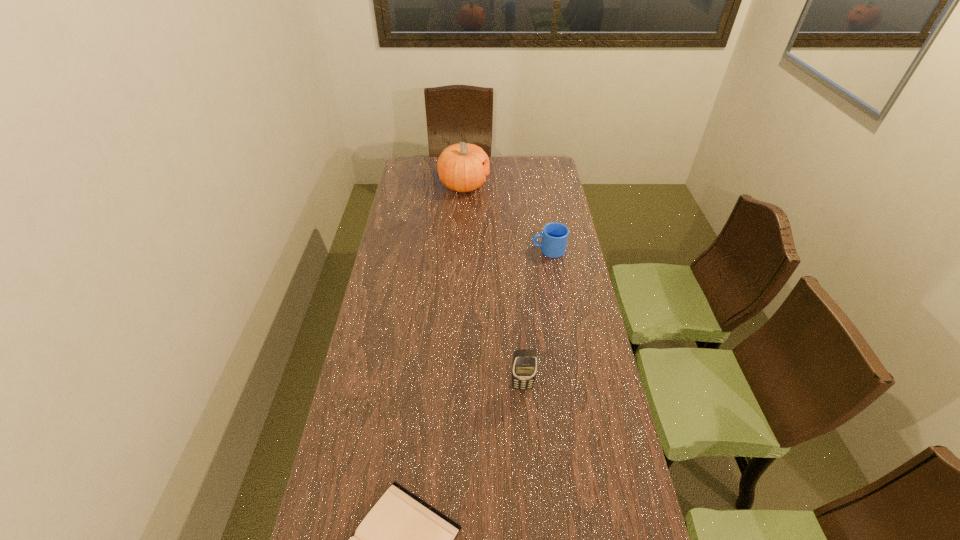
Find the location of a particular element. vacant space situated 0.200m on the side of the mug with the handle is located at coordinates (483, 250).

This screenshot has height=540, width=960. I want to click on object at the far edge, so 463,167.

Image resolution: width=960 pixels, height=540 pixels. Find the location of `object that is at the right edge`. object that is at the right edge is located at coordinates (555, 235).

I want to click on free space at the far edge, so click(523, 179).

The height and width of the screenshot is (540, 960). In the image, there is a desktop. Identify the location of free space at the left edge. (407, 194).

In the image, there is a desktop. Where is `blank space at the right edge`? The width and height of the screenshot is (960, 540). blank space at the right edge is located at coordinates (546, 199).

In the image, there is a desktop. Identify the location of vacant region at the far right corner. Image resolution: width=960 pixels, height=540 pixels. (529, 168).

Where is `empty space between the second shortest object and the third farthest object`? empty space between the second shortest object and the third farthest object is located at coordinates (536, 318).

Locate an element on the screen. Image resolution: width=960 pixels, height=540 pixels. vacant space in between the cellular telephone and the farthest object is located at coordinates (493, 286).

Find the location of `vacant area between the rightmost object and the tallest object`. vacant area between the rightmost object and the tallest object is located at coordinates (506, 218).